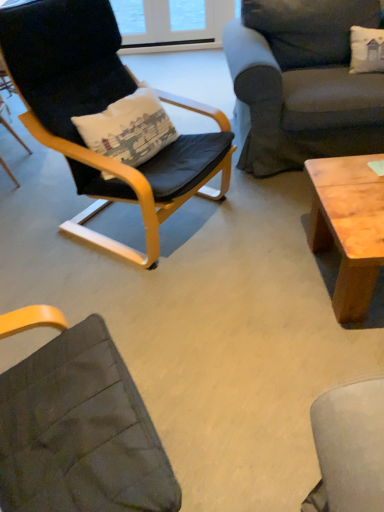
Locate an element on the screen. vacant space behind natural wood coffee table at right is located at coordinates (274, 207).